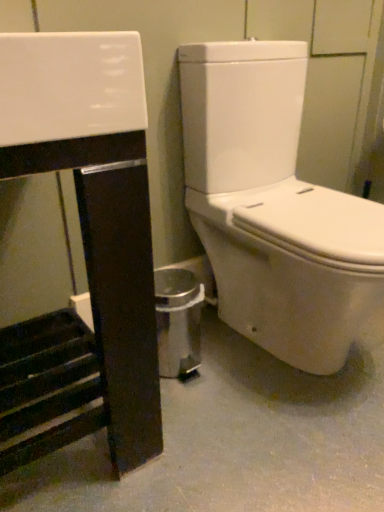
Question: Should I look upward or downward to see glossy black vanity at left?

Choices:
 (A) down
 (B) up

Answer: (A)